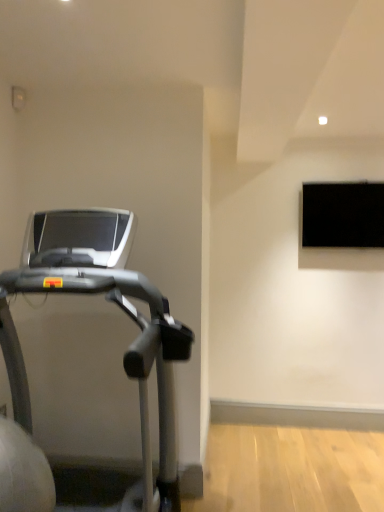
This screenshot has width=384, height=512. I want to click on free spot above black matte tv at upper right (from a real-world perspective), so click(x=350, y=178).